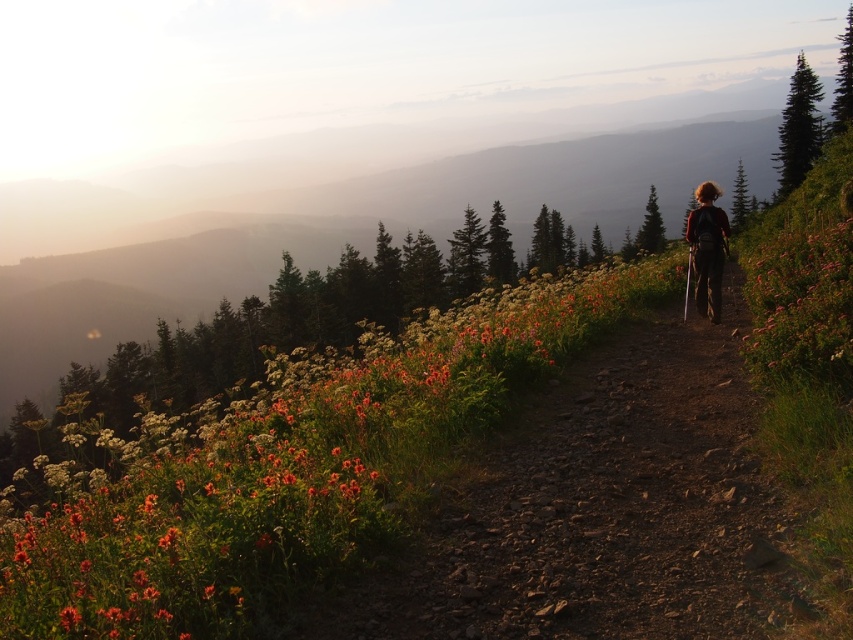
Is dirt path at center below orange matte flowers at center?

Indeed, dirt path at center is positioned under orange matte flowers at center.

Is dirt path at center shorter than orange matte flowers at center?

Yes, dirt path at center is shorter than orange matte flowers at center.

Is point (451, 529) less distant than point (578, 348)?

That is True.

Where is `dirt path at center`? This screenshot has width=853, height=640. dirt path at center is located at coordinates click(601, 509).